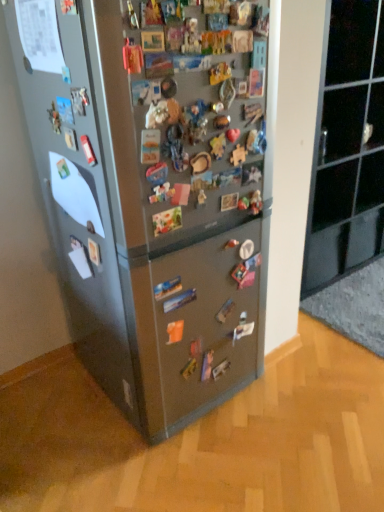
Find the location of `free region on the left part of satin silver fridge at center`. free region on the left part of satin silver fridge at center is located at coordinates (53, 402).